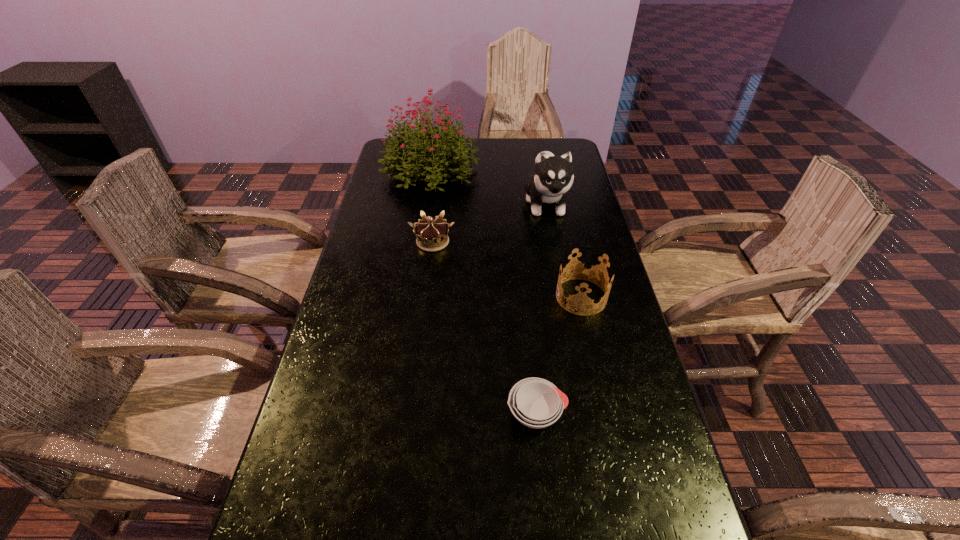
Where is `the tallest object`? the tallest object is located at coordinates (411, 145).

At what (x,y) coordinates should I click in order to perform the action: click on puppy. Please return your answer as a coordinate pair (x, y). Image resolution: width=960 pixels, height=540 pixels. Looking at the image, I should click on (553, 177).

Find the location of `the taller crown`. the taller crown is located at coordinates (579, 298).

At what (x,y) coordinates should I click in order to perform the action: click on the fourth farthest object. Please return your answer as a coordinate pair (x, y). This screenshot has width=960, height=540. Looking at the image, I should click on (579, 298).

Image resolution: width=960 pixels, height=540 pixels. Find the location of `the left crown`. the left crown is located at coordinates (432, 234).

Locate an element on the screen. The width and height of the screenshot is (960, 540). the shorter crown is located at coordinates pos(432,234).

Find the location of a particular element. Image resolution: width=960 pixels, height=540 pixels. soup bowl is located at coordinates (535, 402).

Identify the location of the nearest object. (535, 402).

This screenshot has height=540, width=960. In order to click on free space located on the front of the bouquet in this screenshot , I will do `click(423, 218)`.

You are a GUI agent. You are given a task and a screenshot of the screen. Output one action in this format:
    pyautogui.click(x=<x>, y=<y>)
    Task: Click on the vacant space located at the face of the puppy
    
    Given the screenshot: What is the action you would take?
    pyautogui.click(x=567, y=319)